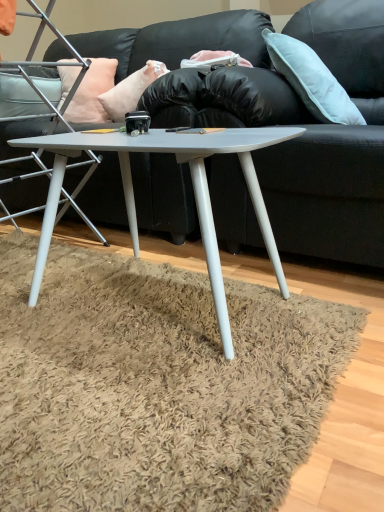
The image size is (384, 512). I want to click on light blue fabric pillow at upper right, which is counted as the third pillow, starting from the left, so click(311, 80).

This screenshot has height=512, width=384. What do you see at coordinates (311, 80) in the screenshot? I see `light blue fabric pillow at upper right, the first pillow from the right` at bounding box center [311, 80].

At what (x,y) coordinates should I click in order to perform the action: click on black leather couch at center. Please return your answer as a coordinate pair (x, y). The height and width of the screenshot is (512, 384). Looking at the image, I should click on (334, 145).

The width and height of the screenshot is (384, 512). I want to click on pink fabric pillow at upper left, the 2th pillow positioned from the right, so click(130, 90).

What do you see at coordinates (130, 90) in the screenshot? I see `pink fabric pillow at upper left, the 2th pillow positioned from the right` at bounding box center [130, 90].

Describe the element at coordinates (35, 63) in the screenshot. The width and height of the screenshot is (384, 512). I see `metallic silver chair at left` at that location.

At what (x,y) coordinates should I click in order to perform the action: click on matte gray coffee table at center. Please return your answer as a coordinate pair (x, y). Looking at the image, I should click on (193, 189).

The image size is (384, 512). I want to click on light blue fabric pillow at upper right, which is counted as the third pillow, starting from the left, so click(311, 80).

Is metallic silver chair at left next to black leather couch at center and touching it?

No, metallic silver chair at left is not next to black leather couch at center.

Is metallic silver chair at left taller than black leather couch at center?

Yes, metallic silver chair at left is taller than black leather couch at center.

Find the location of a particular element. chair below the black leather couch at center (from the image's perspective) is located at coordinates (35, 63).

Considering the positions of points (20, 66) and (267, 162), is point (20, 66) farther from camera compared to point (267, 162)?

Yes.

Does matte gray coffee table at center have a lesser width compared to light blue fabric pillow at upper right, which is counted as the third pillow, starting from the left?

No, matte gray coffee table at center is not thinner than light blue fabric pillow at upper right, which is counted as the third pillow, starting from the left.

At what (x,y) coordinates should I click in order to perform the action: click on coffee table below the light blue fabric pillow at upper right, which is counted as the third pillow, starting from the left (from a real-world perspective). Please return your answer as a coordinate pair (x, y). This screenshot has height=512, width=384. Looking at the image, I should click on (193, 189).

From a real-world perspective, which object stands above the other?

In real-world perspective, light blue fabric pillow at upper right, the first pillow from the right, is above.

Which is closer, (107, 74) or (98, 232)?

Point (107, 74) appears to be farther away from the viewer than point (98, 232).

In terms of size, does peachy fabric pillow at upper left, the 1th pillow positioned from the left, appear bigger or smaller than metallic silver chair at left?

Clearly, peachy fabric pillow at upper left, the 1th pillow positioned from the left, is smaller in size than metallic silver chair at left.

From the image's perspective, who appears lower, peachy fabric pillow at upper left, the third pillow when ordered from right to left, or metallic silver chair at left?

From the image's view, metallic silver chair at left is below.

Does peachy fabric pillow at upper left, the third pillow when ordered from right to left, turn towards metallic silver chair at left?

Yes.

Would you say light blue fabric pillow at upper right, which is counted as the third pillow, starting from the left, is part of pink fabric pillow at upper left, the 2th pillow positioned from the right,'s contents?

No, light blue fabric pillow at upper right, which is counted as the third pillow, starting from the left, is located outside of pink fabric pillow at upper left, the 2th pillow positioned from the right.

Could you tell me if pink fabric pillow at upper left, the second pillow from the left, is facing light blue fabric pillow at upper right, the first pillow from the right?

No, pink fabric pillow at upper left, the second pillow from the left, is not turned towards light blue fabric pillow at upper right, the first pillow from the right.

Considering the sizes of objects pink fabric pillow at upper left, the 2th pillow positioned from the right, and light blue fabric pillow at upper right, the first pillow from the right, in the image provided, who is shorter, pink fabric pillow at upper left, the 2th pillow positioned from the right, or light blue fabric pillow at upper right, the first pillow from the right,?

With less height is pink fabric pillow at upper left, the 2th pillow positioned from the right.

Consider the image. Considering the positions of objects pink fabric pillow at upper left, the second pillow from the left, and light blue fabric pillow at upper right, the first pillow from the right, in the image provided, who is in front, pink fabric pillow at upper left, the second pillow from the left, or light blue fabric pillow at upper right, the first pillow from the right,?

Positioned in front is light blue fabric pillow at upper right, the first pillow from the right.

Where is `the 2nd pillow to the left of the black leather couch at center, starting your count from the anchor`? the 2nd pillow to the left of the black leather couch at center, starting your count from the anchor is located at coordinates (130, 90).

From a real-world perspective, is pink fabric pillow at upper left, the second pillow from the left, physically below black leather couch at center?

Actually, pink fabric pillow at upper left, the second pillow from the left, is physically above black leather couch at center in the real world.

Considering the positions of objects pink fabric pillow at upper left, the second pillow from the left, and black leather couch at center in the image provided, who is more to the right, pink fabric pillow at upper left, the second pillow from the left, or black leather couch at center?

black leather couch at center is more to the right.

In the scene shown: From the image's perspective, relative to black leather couch at center, is pink fabric pillow at upper left, the 2th pillow positioned from the right, above or below?

pink fabric pillow at upper left, the 2th pillow positioned from the right, is above black leather couch at center.

How many degrees apart are the facing directions of matte gray coffee table at center and black leather couch at center?

They differ by 1.17 degrees in their facing directions.

Is point (246, 173) closer to viewer compared to point (150, 229)?

Yes, point (246, 173) is in front of point (150, 229).

Which object is further away from the camera, matte gray coffee table at center or black leather couch at center?

black leather couch at center.

Is matte gray coffee table at center inside or outside of black leather couch at center?

The correct answer is: outside.

Is black leather couch at center facing towards pink fabric pillow at upper left, the second pillow from the left?

No, black leather couch at center is not oriented towards pink fabric pillow at upper left, the second pillow from the left.

Between black leather couch at center and pink fabric pillow at upper left, the second pillow from the left, which one has less height?

With less height is pink fabric pillow at upper left, the second pillow from the left.

Is black leather couch at center further to the viewer compared to pink fabric pillow at upper left, the 2th pillow positioned from the right?

No, black leather couch at center is in front of pink fabric pillow at upper left, the 2th pillow positioned from the right.

Does point (195, 82) lie behind point (118, 90)?

No, (195, 82) is closer to viewer.

Image resolution: width=384 pixels, height=512 pixels. Identify the location of studio couch located on the right of metallic silver chair at left. (334, 145).

Which pillow is the 1st one when counting from the back of the matte gray coffee table at center? Please provide its 2D coordinates.

[(311, 80)]

When comparing their distances from peachy fabric pillow at upper left, the 1th pillow positioned from the left, does pink fabric pillow at upper left, the second pillow from the left, or metallic silver chair at left seem closer?

pink fabric pillow at upper left, the second pillow from the left, lies closer to peachy fabric pillow at upper left, the 1th pillow positioned from the left, than the other object.

Considering their positions, is pink fabric pillow at upper left, the 2th pillow positioned from the right, positioned closer to black leather couch at center than matte gray coffee table at center?

matte gray coffee table at center is positioned closer to the anchor black leather couch at center.

Estimate the real-world distances between objects in this image. Which object is closer to light blue fabric pillow at upper right, the first pillow from the right, peachy fabric pillow at upper left, the 1th pillow positioned from the left, or pink fabric pillow at upper left, the 2th pillow positioned from the right?

The object closer to light blue fabric pillow at upper right, the first pillow from the right, is pink fabric pillow at upper left, the 2th pillow positioned from the right.

Estimate the real-world distances between objects in this image. Which object is closer to peachy fabric pillow at upper left, the 1th pillow positioned from the left, pink fabric pillow at upper left, the 2th pillow positioned from the right, or matte gray coffee table at center?

pink fabric pillow at upper left, the 2th pillow positioned from the right, is positioned closer to the anchor peachy fabric pillow at upper left, the 1th pillow positioned from the left.

Estimate the real-world distances between objects in this image. Which object is further from peachy fabric pillow at upper left, the 1th pillow positioned from the left, metallic silver chair at left or light blue fabric pillow at upper right, which is counted as the third pillow, starting from the left?

→ light blue fabric pillow at upper right, which is counted as the third pillow, starting from the left.

From the image, which object appears to be farther from pink fabric pillow at upper left, the second pillow from the left, metallic silver chair at left or matte gray coffee table at center?

matte gray coffee table at center is further to pink fabric pillow at upper left, the second pillow from the left.

Estimate the real-world distances between objects in this image. Which object is further from metallic silver chair at left, matte gray coffee table at center or peachy fabric pillow at upper left, the 1th pillow positioned from the left?

Based on the image, matte gray coffee table at center appears to be further to metallic silver chair at left.

Based on their spatial positions, is pink fabric pillow at upper left, the second pillow from the left, or black leather couch at center closer to light blue fabric pillow at upper right, the first pillow from the right?

Based on the image, black leather couch at center appears to be nearer to light blue fabric pillow at upper right, the first pillow from the right.

At what (x,y) coordinates should I click in order to perform the action: click on studio couch between matte gray coffee table at center and pink fabric pillow at upper left, the second pillow from the left, along the z-axis. Please return your answer as a coordinate pair (x, y). The height and width of the screenshot is (512, 384). Looking at the image, I should click on (334, 145).

The image size is (384, 512). In order to click on coffee table between metallic silver chair at left and black leather couch at center in this screenshot , I will do `click(193, 189)`.

Locate an element on the screen. This screenshot has width=384, height=512. chair between matte gray coffee table at center and peachy fabric pillow at upper left, the 1th pillow positioned from the left, from front to back is located at coordinates (35, 63).

Identify the location of pillow between black leather couch at center and pink fabric pillow at upper left, the 2th pillow positioned from the right, in the front-back direction. This screenshot has width=384, height=512. (311, 80).